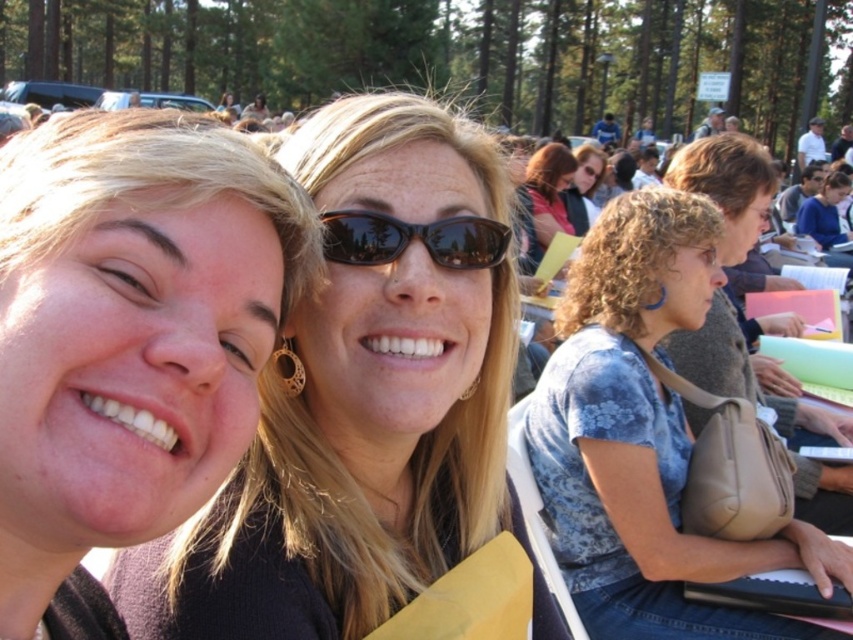
Can you confirm if blue floral shirt at center is thinner than black plastic sunglasses at center?

No.

Does blue floral shirt at center appear over black plastic sunglasses at center?

Actually, blue floral shirt at center is below black plastic sunglasses at center.

Is point (674, 516) farther from camera compared to point (433, 234)?

Yes, point (674, 516) is farther from viewer.

Identify the location of blue floral shirt at center. This screenshot has height=640, width=853. (643, 436).

Does matte black hair at left have a lesser height compared to black plastic sunglasses at center?

No, matte black hair at left is not shorter than black plastic sunglasses at center.

Between point (3, 179) and point (384, 248), which one is positioned in front?

Point (3, 179) is more forward.

The image size is (853, 640). I want to click on matte black hair at left, so click(131, 328).

Does matte black sunglasses at center have a lesser width compared to blue floral shirt at center?

Yes, matte black sunglasses at center is thinner than blue floral shirt at center.

Is matte black sunglasses at center behind blue floral shirt at center?

No, matte black sunglasses at center is closer to the viewer.

What do you see at coordinates (363, 397) in the screenshot? The width and height of the screenshot is (853, 640). I see `matte black sunglasses at center` at bounding box center [363, 397].

At what (x,y) coordinates should I click in order to perform the action: click on matte black sunglasses at center. Please return your answer as a coordinate pair (x, y). The width and height of the screenshot is (853, 640). Looking at the image, I should click on (363, 397).